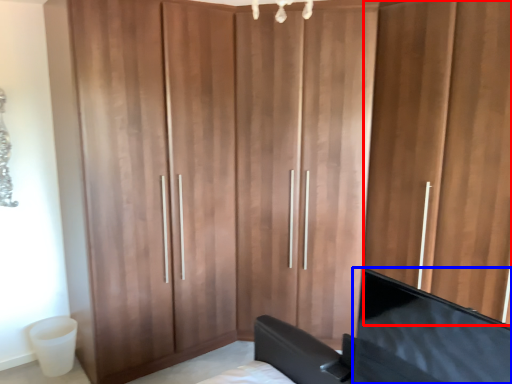
Question: Which of the following is the closest to the observer, door (highlighted by a red box) or flat (highlighted by a blue box)?

Choices:
 (A) door
 (B) flat

Answer: (B)